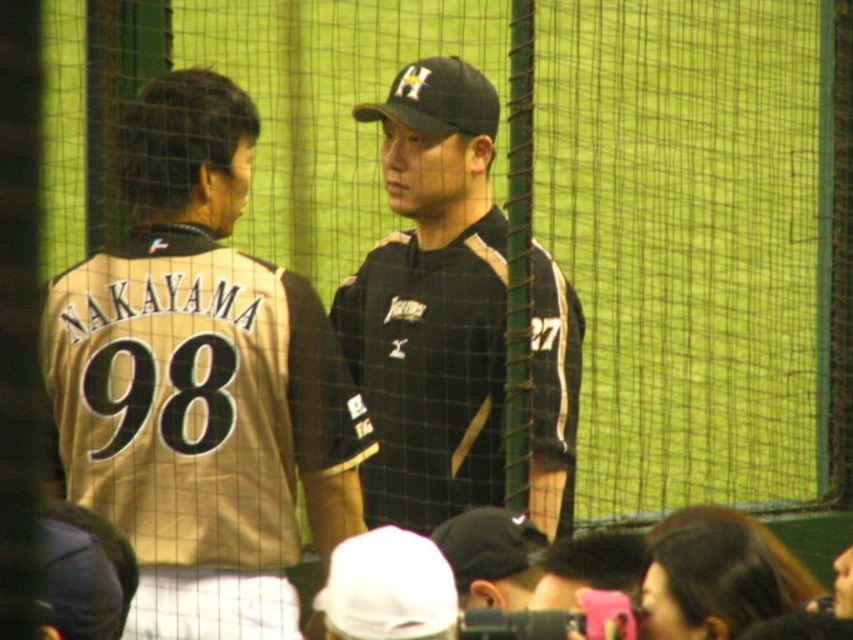
Question: Does gold jersey at left appear over black matte baseball cap at center?

Choices:
 (A) no
 (B) yes

Answer: (A)

Question: Which of the following is the farthest from the observer?

Choices:
 (A) (450, 109)
 (B) (372, 108)
 (C) (167, 84)

Answer: (A)

Question: Can you confirm if black matte uniform at center is bigger than black matte baseball cap at center?

Choices:
 (A) yes
 (B) no

Answer: (A)

Question: Which object is the farthest from the black matte baseball cap at center?

Choices:
 (A) gold jersey at left
 (B) black matte uniform at center

Answer: (A)

Question: Does gold jersey at left have a greater width compared to black matte uniform at center?

Choices:
 (A) no
 (B) yes

Answer: (B)

Question: Which is farther from the black matte baseball cap at center?

Choices:
 (A) black matte uniform at center
 (B) gold jersey at left

Answer: (B)